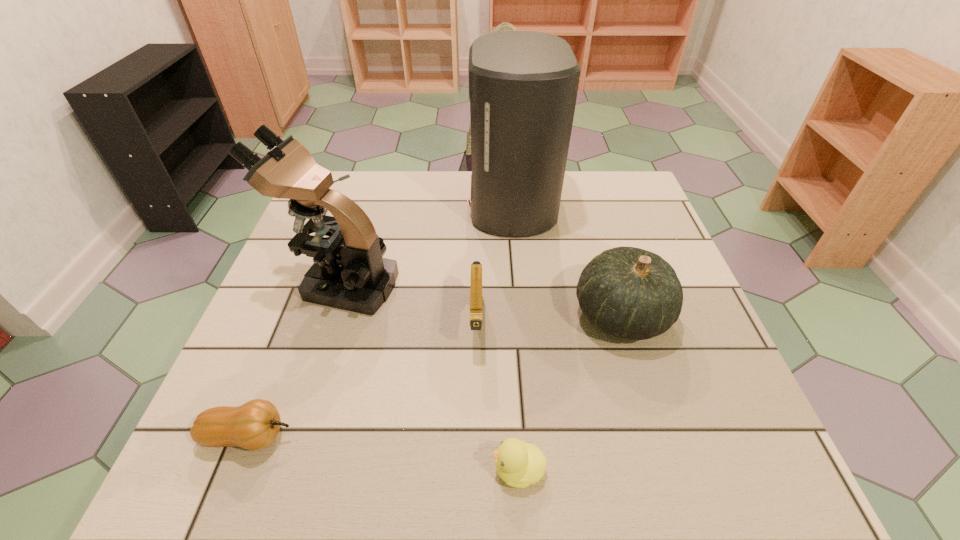
Where is `free location at the near left corner`? free location at the near left corner is located at coordinates (286, 452).

Locate an element on the screen. Image resolution: width=960 pixels, height=540 pixels. vacant space that's between the shorter gourd and the farthest object is located at coordinates (380, 320).

Where is `free space between the duckling and the shorter gourd`? free space between the duckling and the shorter gourd is located at coordinates (384, 453).

I want to click on unoccupied position between the microscope and the shorter gourd, so (x=295, y=361).

Locate an element on the screen. vacant space that is in between the third shortest object and the nearer gourd is located at coordinates (363, 380).

Identify the location of vacant region between the third shortest object and the third tallest object. (549, 319).

In order to click on vacant space that's between the farthest object and the nearer gourd in this screenshot , I will do `click(380, 320)`.

This screenshot has height=540, width=960. I want to click on free space between the farther gourd and the pistol, so click(549, 319).

Identify the location of empty location between the fourth tallest object and the duckling. (497, 396).

Find the location of `free area in between the farther gourd and the coffee maker`. free area in between the farther gourd and the coffee maker is located at coordinates coord(566,260).